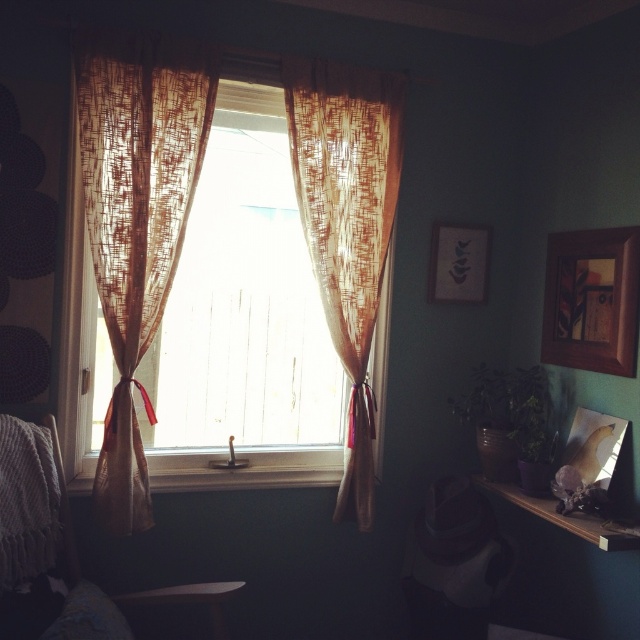
Who is shorter, translucent brown curtain at left or wooden shelf at lower right?

wooden shelf at lower right is shorter.

Does translucent brown curtain at left have a lesser width compared to wooden shelf at lower right?

No.

This screenshot has width=640, height=640. Identify the location of translucent brown curtain at left. (136, 221).

Does translucent brown curtain at left have a smaller size compared to translucent brown curtain at center?

Actually, translucent brown curtain at left might be larger than translucent brown curtain at center.

Does translucent brown curtain at left have a larger size compared to translucent brown curtain at center?

Yes, translucent brown curtain at left is bigger than translucent brown curtain at center.

Does point (198, 150) come in front of point (348, 356)?

That is True.

You are a GUI agent. You are given a task and a screenshot of the screen. Output one action in this format:
    pyautogui.click(x=<x>, y=<y>)
    Task: Click on the translucent brown curtain at left
    The width and height of the screenshot is (640, 640).
    Given the screenshot: What is the action you would take?
    pyautogui.click(x=136, y=221)

Between translucent brown curtain at left and matte wooden picture frame at upper right, which one appears on the right side from the viewer's perspective?

Positioned to the right is matte wooden picture frame at upper right.

The image size is (640, 640). What do you see at coordinates (136, 221) in the screenshot?
I see `translucent brown curtain at left` at bounding box center [136, 221].

Which is in front, point (131, 456) or point (435, 300)?

Positioned in front is point (131, 456).

The image size is (640, 640). Identify the location of translucent brown curtain at left. (136, 221).